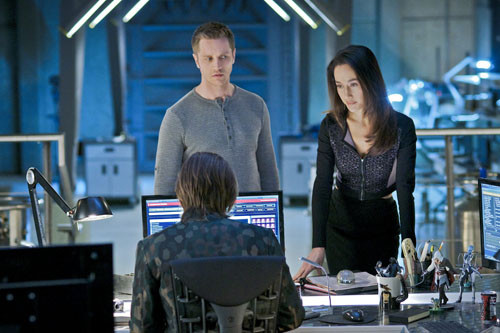
You are a GUI agent. You are given a task and a screenshot of the screen. Output one action in this format:
    pyautogui.click(x=<x>, y=<y>)
    Task: Click on the dark grey columns
    The width and height of the screenshot is (500, 333).
    Given the screenshot: What is the action you would take?
    pyautogui.click(x=74, y=73), pyautogui.click(x=116, y=55)